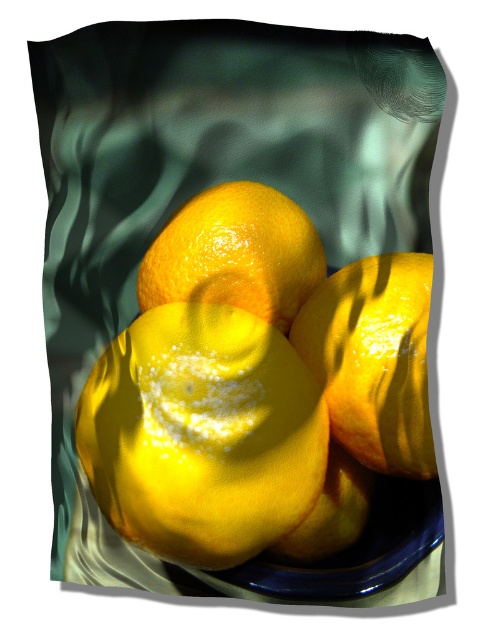
Does glossy yellow lemon at center appear under glossy yellow tangerine at center?

Yes.

Looking at this image, does glossy yellow lemon at center appear over glossy yellow tangerine at center?

No.

Between point (239, 513) and point (228, 216), which one is positioned in front?

Positioned in front is point (239, 513).

The image size is (480, 640). I want to click on glossy yellow lemon at center, so click(255, 387).

Can you confirm if shiny yellow lemon at center is positioned above glossy yellow tangerine at center?

Actually, shiny yellow lemon at center is below glossy yellow tangerine at center.

How far apart are shiny yellow lemon at center and glossy yellow tangerine at center?

A distance of 3.70 inches exists between shiny yellow lemon at center and glossy yellow tangerine at center.

Is point (167, 468) more distant than point (229, 198)?

No, it is in front of (229, 198).

Image resolution: width=480 pixels, height=640 pixels. I want to click on shiny yellow lemon at center, so click(202, 435).

Is glossy yellow lemon at center smaller than glossy citrus fruit at center?

Actually, glossy yellow lemon at center might be larger than glossy citrus fruit at center.

Is glossy yellow lemon at center shorter than glossy citrus fruit at center?

No, glossy yellow lemon at center is not shorter than glossy citrus fruit at center.

Locate an element on the screen. The image size is (480, 640). glossy yellow lemon at center is located at coordinates (255, 387).